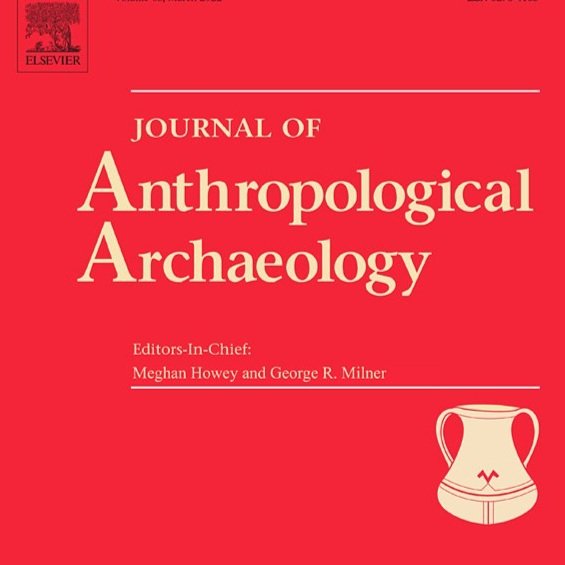
This screenshot has width=565, height=565. Find the location of `pot`. pot is located at coordinates (504, 482).